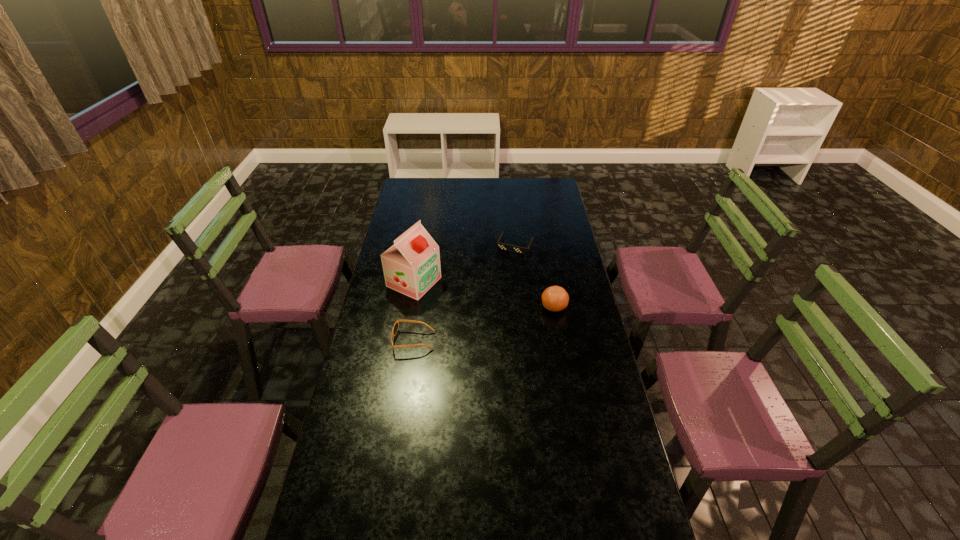
Where is `free space located with the cap open on the tallest object`? free space located with the cap open on the tallest object is located at coordinates (464, 303).

Find the location of `free space located with the cap open on the tallest object`. free space located with the cap open on the tallest object is located at coordinates (445, 295).

Find the location of a particular element. vacant space positioned 0.390m with the cap open on the tallest object is located at coordinates (517, 326).

This screenshot has width=960, height=540. Identify the location of vacant space located 0.170m on the front-facing side of the shortest object. (499, 278).

The image size is (960, 540). What are the coordinates of `vacant space positioned 0.050m on the front-facing side of the shortest object` in the screenshot? It's located at click(x=507, y=261).

Where is `vacant space located on the front-facing side of the shortest object`? vacant space located on the front-facing side of the shortest object is located at coordinates (499, 279).

Image resolution: width=960 pixels, height=540 pixels. In order to click on sunglasses that is at the left edge in this screenshot , I will do `click(395, 328)`.

This screenshot has width=960, height=540. Identify the location of soya milk that is at the left edge. (411, 266).

Where is `object that is at the right edge`? The height and width of the screenshot is (540, 960). object that is at the right edge is located at coordinates (555, 298).

In the image, there is a desktop. Where is `free region at the far edge`? This screenshot has width=960, height=540. free region at the far edge is located at coordinates (495, 192).